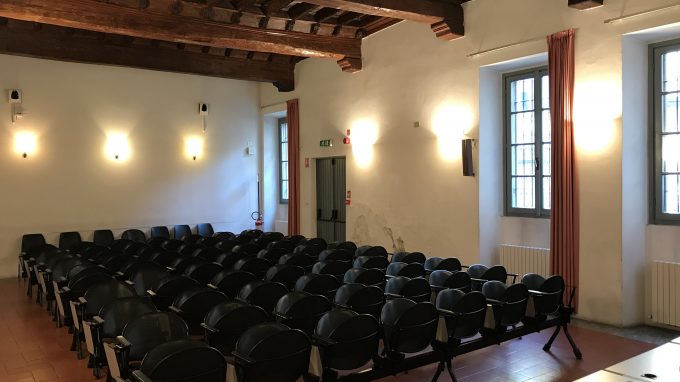
This screenshot has height=382, width=680. In order to click on chairs in this screenshot , I will do `click(222, 291)`.